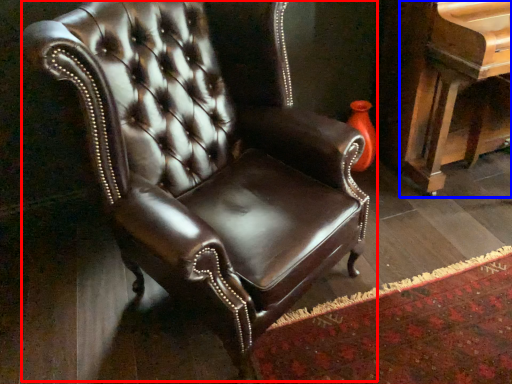
Question: Which object is closer to the camera taking this photo, chair (highlighted by a red box) or piano (highlighted by a blue box)?

Choices:
 (A) chair
 (B) piano

Answer: (A)